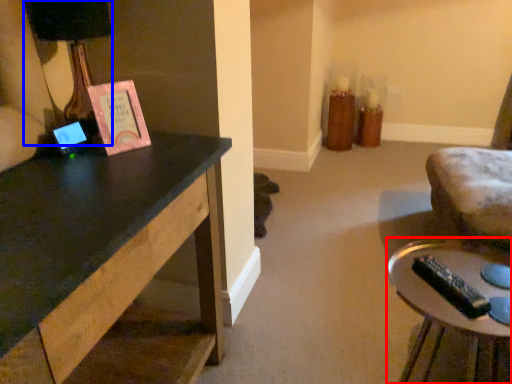
Question: Which object is further to the camera taking this photo, table (highlighted by a red box) or table lamp (highlighted by a blue box)?

Choices:
 (A) table
 (B) table lamp

Answer: (B)